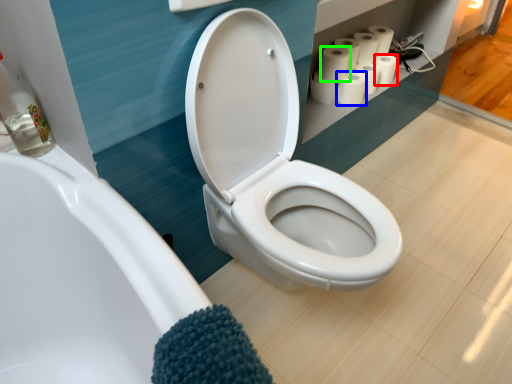
Question: Which is nearer to the toilet paper (highlighted by a red box)? paper towel (highlighted by a blue box) or toilet paper (highlighted by a green box).

Choices:
 (A) paper towel
 (B) toilet paper

Answer: (A)